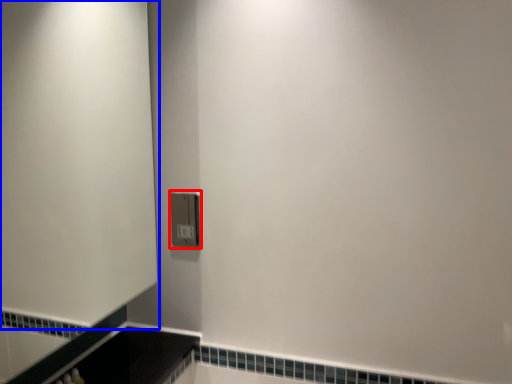
Question: Which of the following is the closest to the observer, light switch (highlighted by a red box) or screen door (highlighted by a blue box)?

Choices:
 (A) light switch
 (B) screen door

Answer: (B)